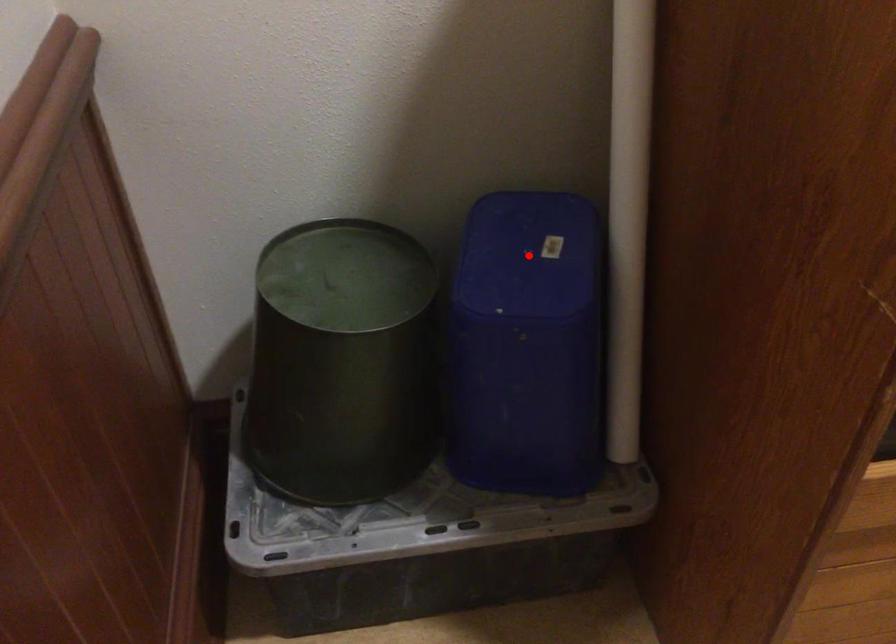
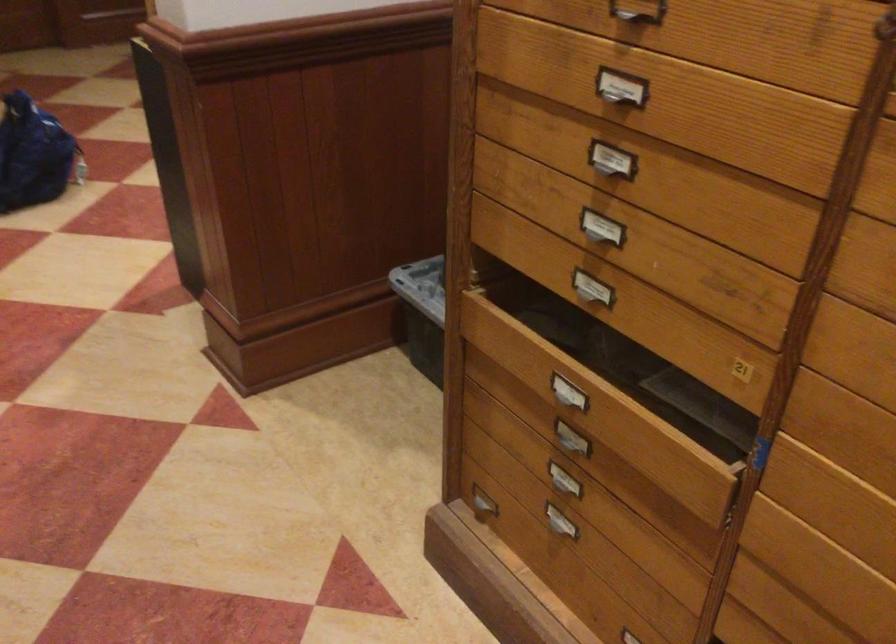
Question: I am providing you with two images of the same scene from different viewpoints. A red point is marked on the first image. At the location where the point appears in image 1, is it still visible in image 2?

Choices:
 (A) Yes
 (B) No

Answer: (B)